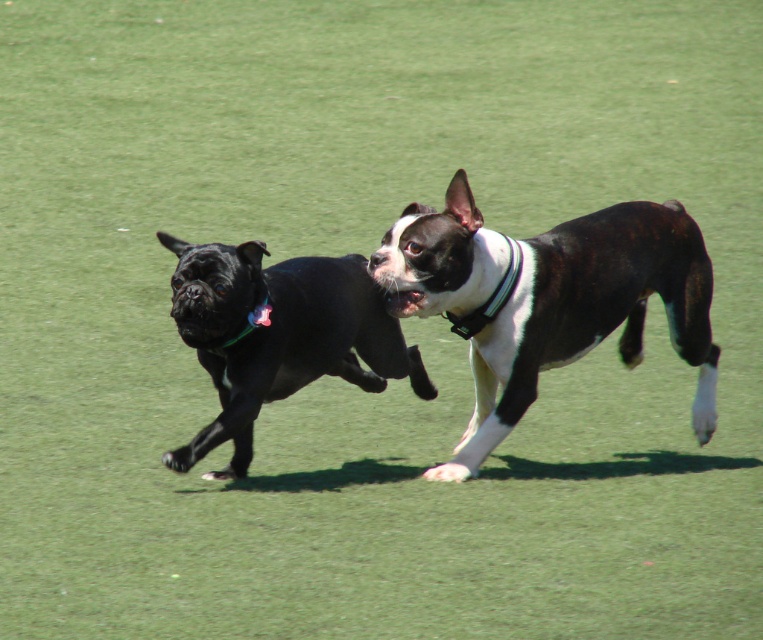
You are a veterinarian observing two dogs in a field. You need to determine which dog is bigger based on their collars. The black and white fur dog at center has a green collar with a pink tag, and the shiny black dog at left has a black collar with a green stripe. Which dog is bigger?

The black and white fur dog at center is larger in size compared to the shiny black dog at left.

From the picture: You are standing at the camera position and want to throw a ball to the black and white fur dog at center. If your throwing range is 15 feet, will the ball reach the dog?

The black and white fur dog at center is 16.39 feet away from the camera, which is beyond your throwing range of 15 feet. The ball will not reach the dog.

You are standing in the field and want to throw a ball to a spot exactly 5 meters away. Is the point at coordinates point [504,323] within your target distance?

The point at coordinates point [504,323] is 5.35 meters from the viewer, which is slightly beyond the 5 meter target distance.